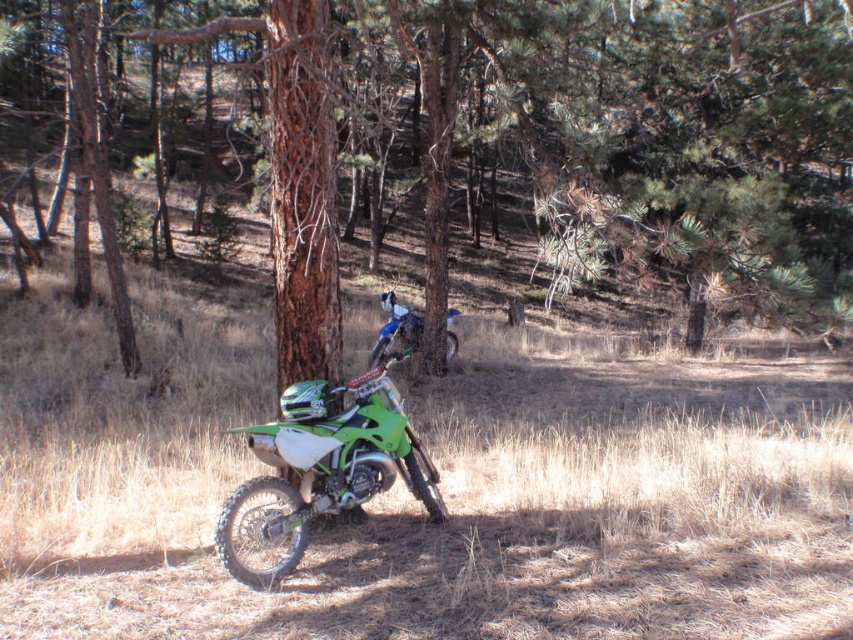
Can you confirm if green matte dirt bike at center is wider than green matte motorbike at center?

Correct, the width of green matte dirt bike at center exceeds that of green matte motorbike at center.

Between green matte dirt bike at center and green matte motorbike at center, which one is positioned higher?

Positioned higher is green matte dirt bike at center.

At what (x,y) coordinates should I click in order to perform the action: click on green matte dirt bike at center. Please return your answer as a coordinate pair (x, y). The width and height of the screenshot is (853, 640). Looking at the image, I should click on (663, 140).

This screenshot has height=640, width=853. Describe the element at coordinates (663, 140) in the screenshot. I see `green matte dirt bike at center` at that location.

Is point (322, 99) closer to camera compared to point (387, 307)?

Yes, point (322, 99) is in front of point (387, 307).

The image size is (853, 640). Describe the element at coordinates (663, 140) in the screenshot. I see `green matte dirt bike at center` at that location.

Where is `green matte dirt bike at center`? green matte dirt bike at center is located at coordinates (663, 140).

Between green matte motorbike at center and blue metallic motorcycle at center, which one appears on the right side from the viewer's perspective?

From the viewer's perspective, blue metallic motorcycle at center appears more on the right side.

Locate an element on the screen. Image resolution: width=853 pixels, height=640 pixels. green matte motorbike at center is located at coordinates (323, 467).